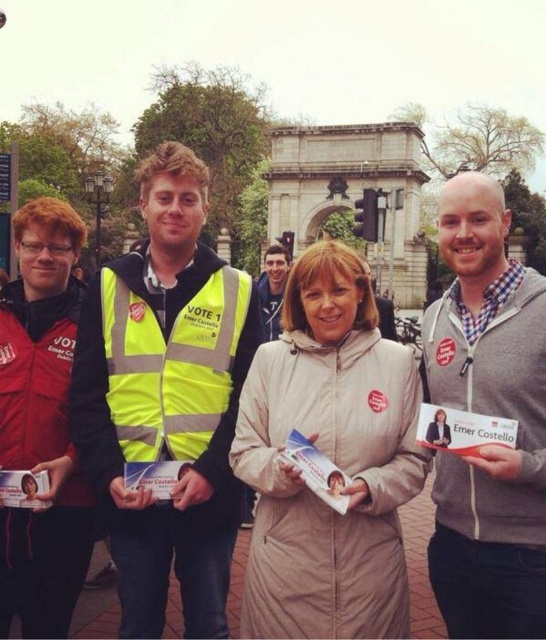
Between yellow reflective vest at center and beige fleece jacket at center, which one appears on the left side from the viewer's perspective?

yellow reflective vest at center is more to the left.

Can you confirm if yellow reflective vest at center is positioned to the left of beige fleece jacket at center?

Indeed, yellow reflective vest at center is positioned on the left side of beige fleece jacket at center.

Describe the element at coordinates (165, 401) in the screenshot. This screenshot has width=546, height=640. I see `yellow reflective vest at center` at that location.

You are a GUI agent. You are given a task and a screenshot of the screen. Output one action in this format:
    pyautogui.click(x=<x>, y=<y>)
    Task: Click on the yellow reflective vest at center
    
    Given the screenshot: What is the action you would take?
    pyautogui.click(x=165, y=401)

Who is positioned more to the right, beige fabric coat at center or light brown hair at center?

light brown hair at center is more to the right.

Who is positioned more to the left, beige fabric coat at center or light brown hair at center?

Positioned to the left is beige fabric coat at center.

Who is more forward, (74,248) or (278,246)?

Positioned in front is point (74,248).

Locate an element on the screen. beige fabric coat at center is located at coordinates (41, 422).

Is point (175, 198) positioned after point (276, 310)?

That is False.

In the scene shown: Is yellow reflective vest at center closer to the viewer compared to light brown hair at center?

Yes.

Does point (206, 547) lie behind point (278, 291)?

No, (206, 547) is in front of (278, 291).

The width and height of the screenshot is (546, 640). In order to click on yellow reflective vest at center in this screenshot , I will do `click(165, 401)`.